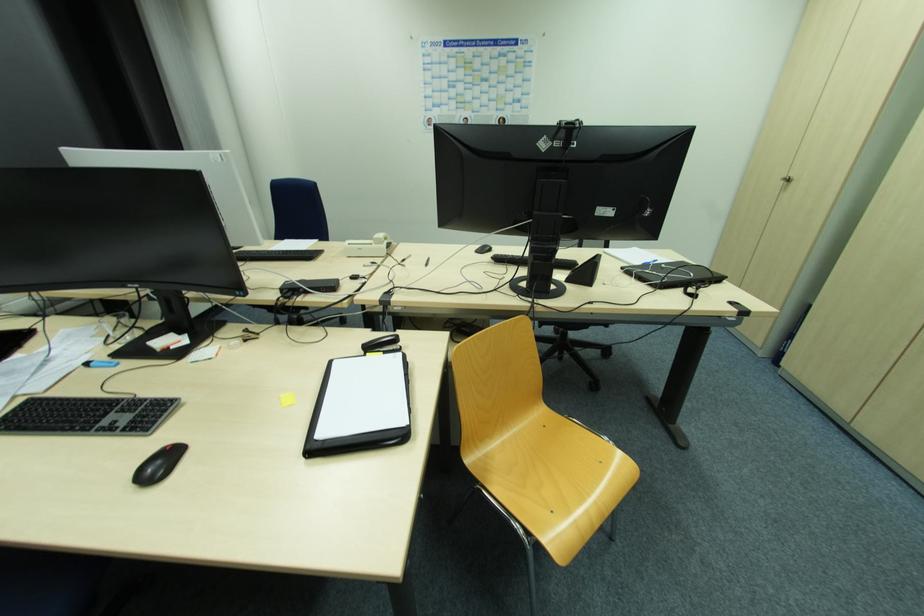
You are a GUI agent. You are given a task and a screenshot of the screen. Output one action in this format:
    pyautogui.click(x=<x>, y=<y>)
    Task: Click on the silver cabinet knob
    The image size is (924, 616).
    Given the screenshot: What is the action you would take?
    pyautogui.click(x=785, y=180)